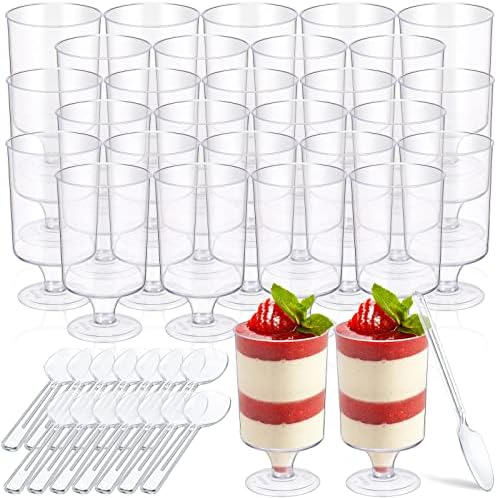
This screenshot has height=498, width=497. I want to click on top row of glasses, so click(255, 21).